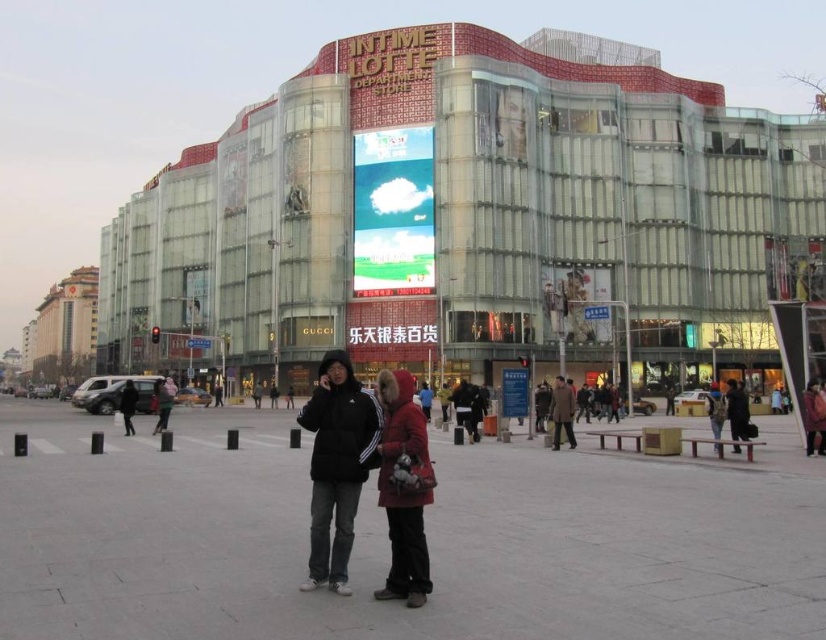
From the picture: Is dark gray cotton jacket at center thinner than brown wool coat at center?

No.

Consider the image. Does dark gray cotton jacket at center have a larger size compared to brown wool coat at center?

Correct, dark gray cotton jacket at center is larger in size than brown wool coat at center.

Is point (416, 451) positioned behind point (573, 438)?

No, (416, 451) is in front of (573, 438).

Locate an element on the screen. Image resolution: width=826 pixels, height=640 pixels. dark gray cotton jacket at center is located at coordinates pos(363,474).

Can you confirm if dark gray cotton jacket at center is thinner than dark gray jacket at center?

Indeed, dark gray cotton jacket at center has a lesser width compared to dark gray jacket at center.

Is point (326, 403) farther from camera compared to point (738, 429)?

That is False.

Who is more forward, (331, 396) or (710, 400)?

Point (331, 396) is in front.

What are the coordinates of `dark gray cotton jacket at center` in the screenshot? It's located at (363, 474).

Between dark gray jacket at center and dark gray hoodie at center, which one has more height?

dark gray jacket at center is taller.

Consider the image. Is dark gray jacket at center further to camera compared to dark gray hoodie at center?

No, dark gray jacket at center is closer to the viewer.

Who is more distant from viewer, (x=739, y=436) or (x=155, y=420)?

Positioned behind is point (x=155, y=420).

In order to click on dark gray jacket at center in this screenshot , I will do `click(729, 410)`.